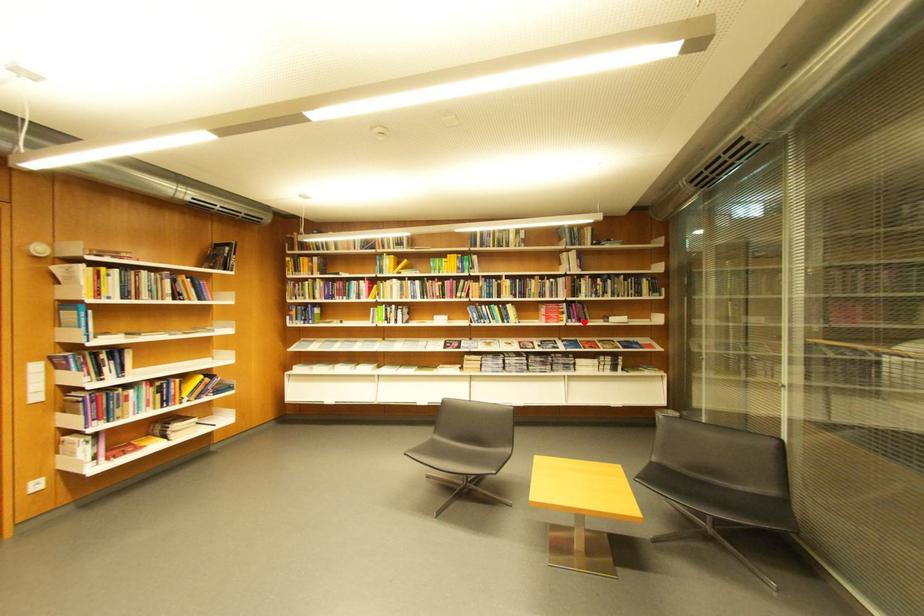
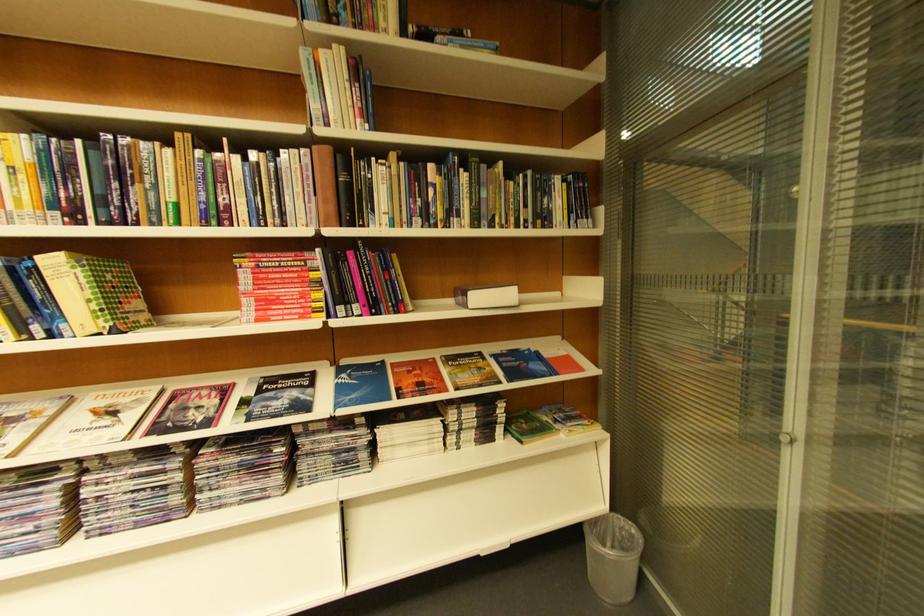
The point at the highlighted location is marked in the first image. Where is the corresponding point in the second image?

(367, 310)